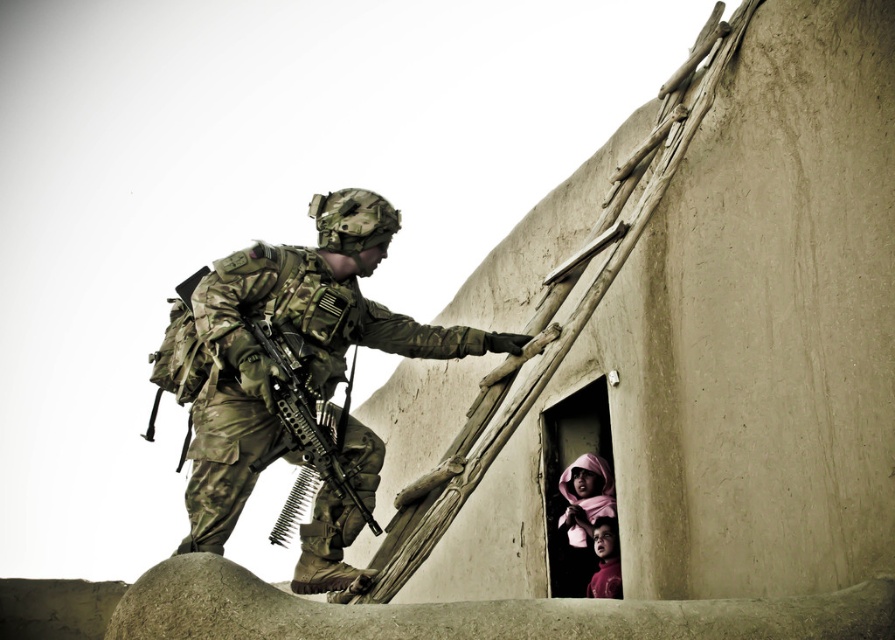
Question: Observing the image, what is the correct spatial positioning of camouflage uniform at center in reference to camouflage-patterned rifle at center?

Choices:
 (A) left
 (B) right

Answer: (A)

Question: Does camouflage uniform at center appear over camouflage-patterned rifle at center?

Choices:
 (A) yes
 (B) no

Answer: (A)

Question: From the image, what is the correct spatial relationship of camouflage uniform at center in relation to camouflage-patterned rifle at center?

Choices:
 (A) below
 (B) above

Answer: (B)

Question: Which object is closer to the camera taking this photo?

Choices:
 (A) camouflage uniform at center
 (B) camouflage-patterned rifle at center

Answer: (A)

Question: Which point appears farthest from the camera in this image?

Choices:
 (A) (303, 467)
 (B) (348, 458)

Answer: (A)